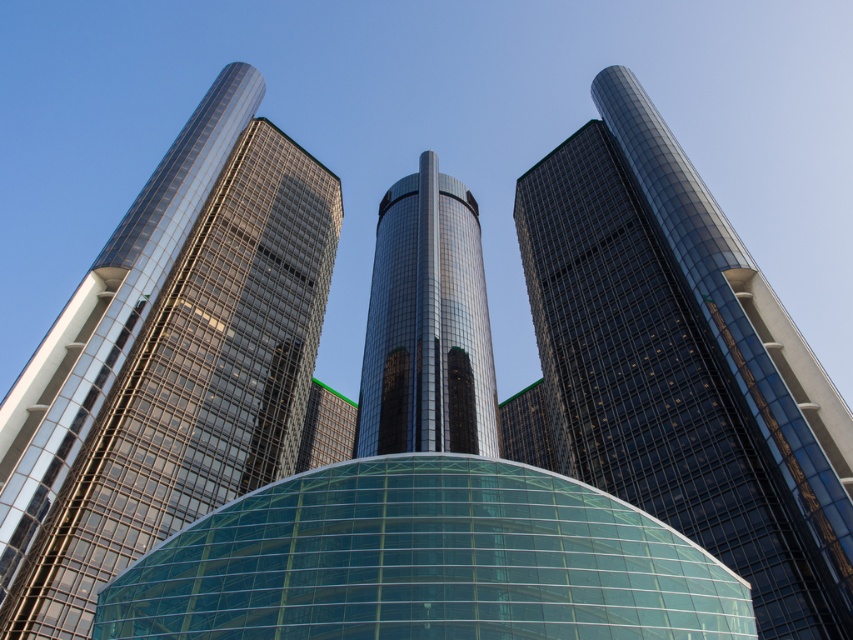
You are standing in front of two glass skyscrapers. The shiny glass skyscraper at center and the glossy glass skyscraper at center. Which one is closer to you?

The shiny glass skyscraper at center is closer to the viewer than the glossy glass skyscraper at center.

You are an architect evaluating the design of the shiny glass skyscraper at center and the glossy glass tower at center. Which of the two structures is taller?

The shiny glass skyscraper at center is taller than the glossy glass tower at center according to the description.

You are an architect analyzing the skyscraper cluster. You notice the shiny glass skyscraper at center and the glossy glass skyscraper at center. Which one is positioned lower in the image?

The shiny glass skyscraper at center is positioned lower than the glossy glass skyscraper at center, as it is described to be below it.